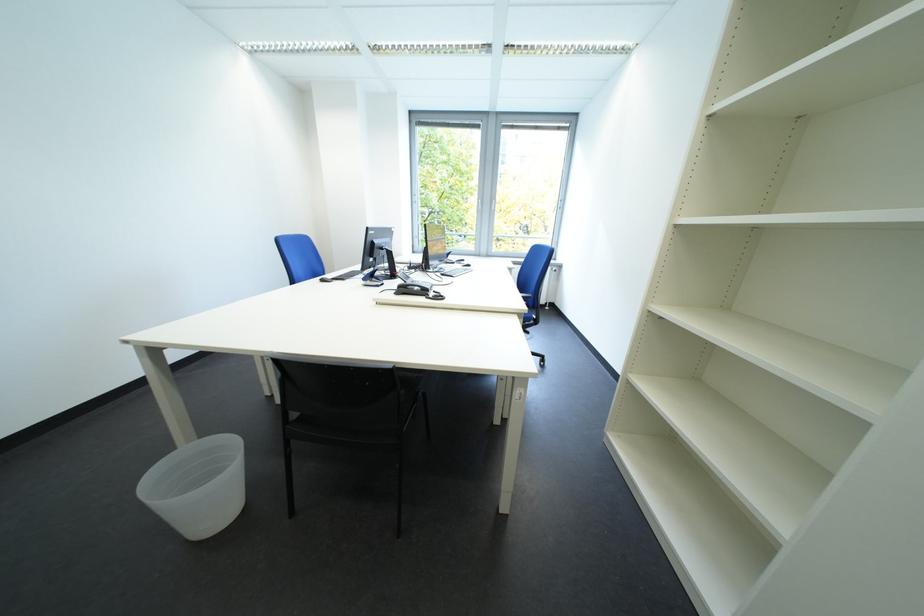
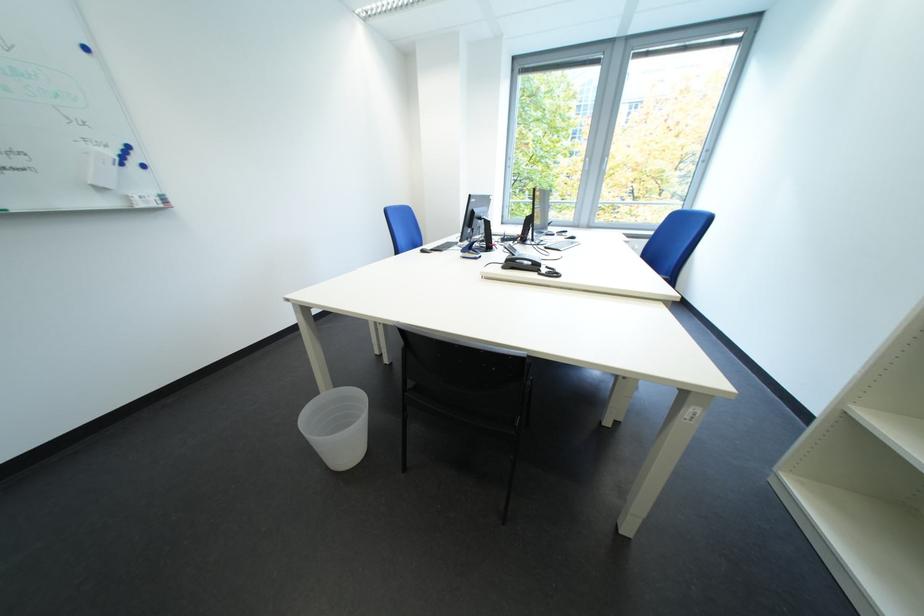
Find the pixel in the second image that matches pixel 417 293 in the first image.

(524, 265)